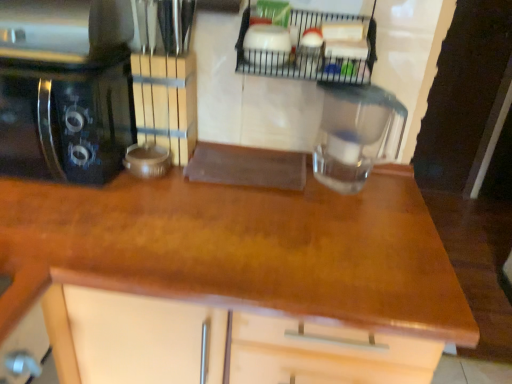
Question: Can you confirm if metallic wire rack at upper center is bigger than transparent glass jar at center?

Choices:
 (A) yes
 (B) no

Answer: (B)

Question: Is metallic wire rack at upper center far from transparent glass jar at center?

Choices:
 (A) yes
 (B) no

Answer: (B)

Question: Is metallic wire rack at upper center at the left side of transparent glass jar at center?

Choices:
 (A) no
 (B) yes

Answer: (B)

Question: Is the position of metallic wire rack at upper center less distant than that of transparent glass jar at center?

Choices:
 (A) yes
 (B) no

Answer: (A)

Question: From a real-world perspective, is metallic wire rack at upper center under transparent glass jar at center?

Choices:
 (A) no
 (B) yes

Answer: (A)

Question: In terms of width, does black glossy coffee maker at left look wider or thinner when compared to metallic wire rack at upper center?

Choices:
 (A) thin
 (B) wide

Answer: (B)

Question: In the image, is black glossy coffee maker at left on the left side or the right side of metallic wire rack at upper center?

Choices:
 (A) right
 (B) left

Answer: (B)

Question: Do you think black glossy coffee maker at left is within metallic wire rack at upper center, or outside of it?

Choices:
 (A) outside
 (B) inside

Answer: (A)

Question: Looking at the image, does black glossy coffee maker at left seem bigger or smaller compared to metallic wire rack at upper center?

Choices:
 (A) big
 (B) small

Answer: (A)

Question: From their relative heights in the image, would you say black glossy coffee maker at left is taller or shorter than wooden at center?

Choices:
 (A) tall
 (B) short

Answer: (B)

Question: From a real-world perspective, is black glossy coffee maker at left above or below wooden at center?

Choices:
 (A) above
 (B) below

Answer: (A)

Question: Does point (75, 107) appear closer or farther from the camera than point (261, 281)?

Choices:
 (A) closer
 (B) farther

Answer: (B)

Question: Is black glossy coffee maker at left to the left or to the right of wooden at center in the image?

Choices:
 (A) left
 (B) right

Answer: (A)

Question: From the image's perspective, is wooden at center positioned above or below transparent glass jar at center?

Choices:
 (A) above
 (B) below

Answer: (B)

Question: Considering their positions, is wooden at center located in front of or behind transparent glass jar at center?

Choices:
 (A) front
 (B) behind

Answer: (A)